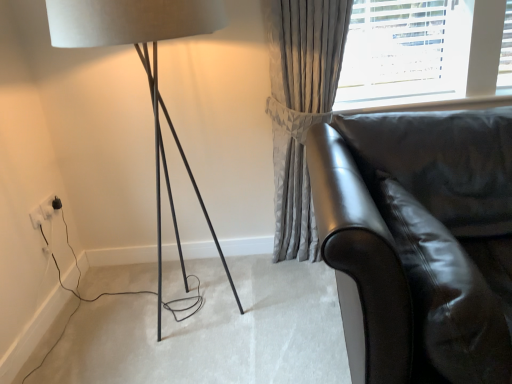
Find the location of `vacant space underneath matte black lamp at left (from a real-world perspective)`. vacant space underneath matte black lamp at left (from a real-world perspective) is located at coordinates (197, 320).